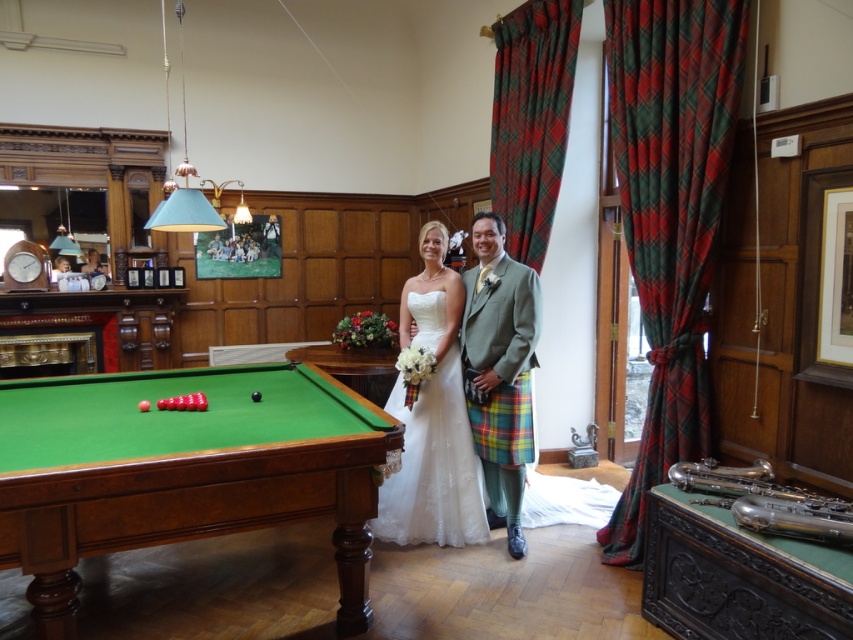
You are a photographer at the wedding and need to position yourself to capture both the green wood billiard table at lower left and the white satin dress at center in the same frame. Based on their positions, which object should you place on the left side of your camera frame?

The green wood billiard table at lower left is positioned to the left of the white satin dress at center, so you should place the green wood billiard table at lower left on the left side of your camera frame to include both in the shot.

You are a photographer at the wedding scene. You need to position yourself at the center of the room to capture the couple. However, there is a green wood billiard table at lower left in the way. Can you move the table to the side to get a clear shot?

The green wood billiard table at lower left is located at point (183, 472), so moving it to the side would allow you to position yourself at the center of the room for an unobstructed view of the couple.